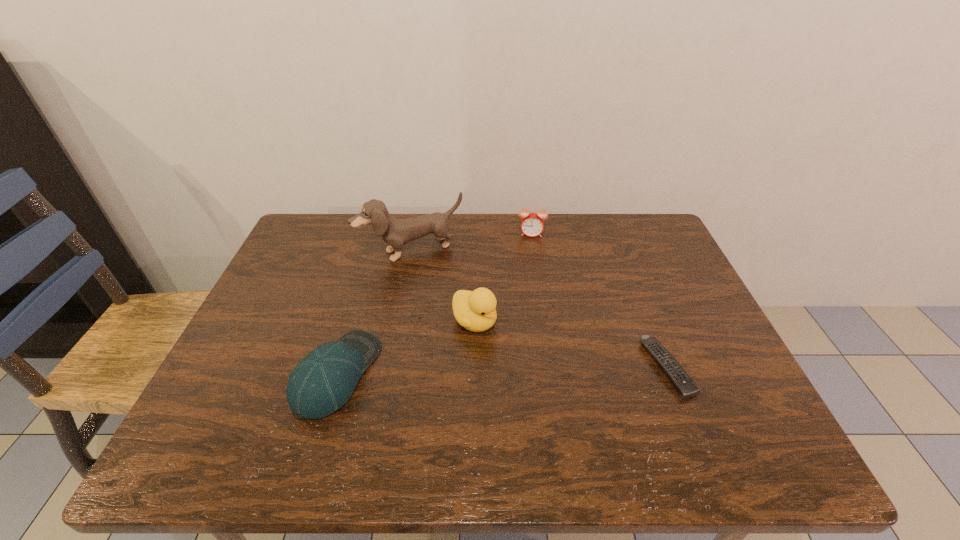
Where is `vacant area located 0.310m at the face of the puppy`? The width and height of the screenshot is (960, 540). vacant area located 0.310m at the face of the puppy is located at coordinates (468, 339).

At what (x,y) coordinates should I click in order to perform the action: click on free space located 0.070m on the front-facing side of the duck. Please return your answer as a coordinate pair (x, y). Looking at the image, I should click on (513, 348).

The width and height of the screenshot is (960, 540). Find the location of `vacant region located 0.350m on the front-facing side of the duck`. vacant region located 0.350m on the front-facing side of the duck is located at coordinates (615, 420).

Locate an element on the screen. vacant position located on the front-facing side of the duck is located at coordinates (612, 417).

Identify the location of vacant space situated on the clock face of the alarm clock. The width and height of the screenshot is (960, 540). (528, 297).

At what (x,y) coordinates should I click in order to perform the action: click on vacant area located on the clock face of the alarm clock. Please return your answer as a coordinate pair (x, y). The width and height of the screenshot is (960, 540). Looking at the image, I should click on (526, 330).

Locate an element on the screen. The width and height of the screenshot is (960, 540). vacant space located on the clock face of the alarm clock is located at coordinates (529, 273).

At what (x,y) coordinates should I click in order to perform the action: click on puppy that is at the far edge. Please return your answer as a coordinate pair (x, y). This screenshot has width=960, height=540. Looking at the image, I should click on (396, 232).

In order to click on alarm clock that is at the far edge in this screenshot , I will do `click(532, 225)`.

The height and width of the screenshot is (540, 960). What are the coordinates of `baseball cap that is positioned at the near edge` in the screenshot? It's located at (323, 381).